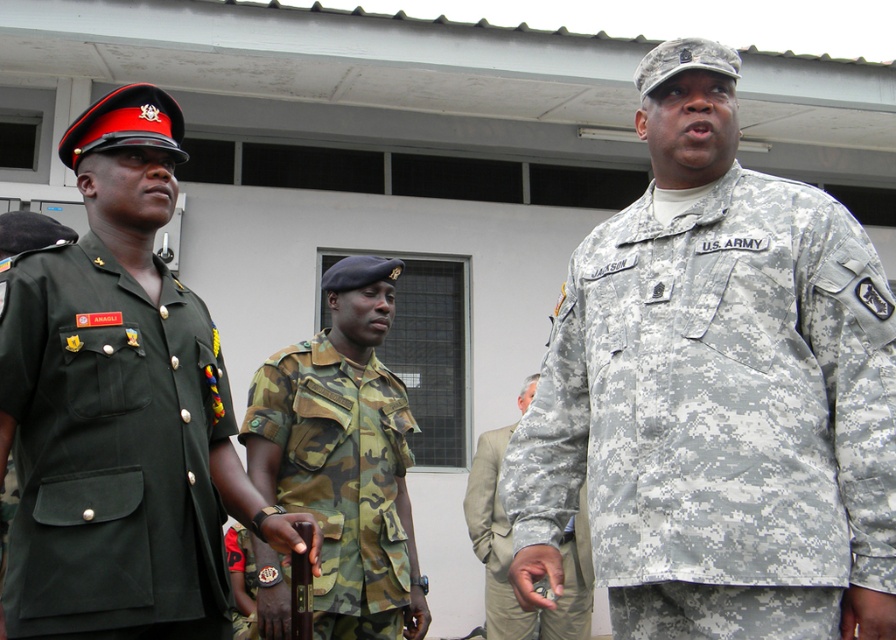
Who is lower down, green fabric uniform at left or camo fabric uniform at center?

camo fabric uniform at center

Does point (28, 516) come in front of point (332, 493)?

Yes, point (28, 516) is in front of point (332, 493).

Find the location of `green fabric uniform at left`. green fabric uniform at left is located at coordinates (109, 448).

Which is behind, point (616, 228) or point (584, 506)?

The point (584, 506) is more distant.

Which of these two, camouflage fabric us army uniform at center or camouflage fabric uniform at center, stands taller?

Standing taller between the two is camouflage fabric uniform at center.

Is point (752, 529) positioned behind point (505, 440)?

No, it is not.

Where is `camouflage fabric us army uniform at center`? This screenshot has height=640, width=896. camouflage fabric us army uniform at center is located at coordinates (718, 397).

Is camo fabric uniform at center shorter than camouflage fabric uniform at center?

Yes.

Consider the image. Is camo fabric uniform at center behind camouflage fabric uniform at center?

No, it is in front of camouflage fabric uniform at center.

Does point (345, 384) lie behind point (488, 456)?

No.

Find the location of `camo fabric uniform at center`. camo fabric uniform at center is located at coordinates (341, 481).